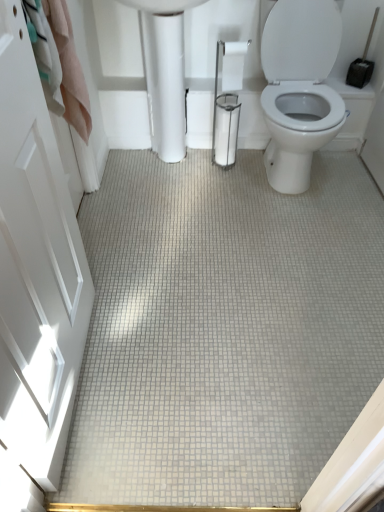
Question: Can you confirm if white glossy toilet paper at center is positioned to the left of white glossy porcelain at center?

Choices:
 (A) no
 (B) yes

Answer: (A)

Question: Can you see white glossy toilet paper at center touching white glossy porcelain at center?

Choices:
 (A) yes
 (B) no

Answer: (B)

Question: Is white glossy toilet paper at center far away from white glossy porcelain at center?

Choices:
 (A) no
 (B) yes

Answer: (A)

Question: From a real-world perspective, is white glossy toilet paper at center located higher than white glossy porcelain at center?

Choices:
 (A) yes
 (B) no

Answer: (A)

Question: Can you confirm if white glossy toilet paper at center is wider than white glossy porcelain at center?

Choices:
 (A) yes
 (B) no

Answer: (B)

Question: In the image, is white glossy porcelain at center on the left side or the right side of white glossy toilet paper at center?

Choices:
 (A) left
 (B) right

Answer: (A)

Question: From the image's perspective, is white glossy porcelain at center above or below white glossy toilet paper at center?

Choices:
 (A) below
 (B) above

Answer: (A)

Question: Choose the correct answer: Is white glossy porcelain at center inside white glossy toilet paper at center or outside it?

Choices:
 (A) inside
 (B) outside

Answer: (B)

Question: In terms of size, does white glossy porcelain at center appear bigger or smaller than white glossy toilet paper at center?

Choices:
 (A) small
 (B) big

Answer: (B)

Question: Is white glossy porcelain at center to the left or to the right of white glossy door at left in the image?

Choices:
 (A) right
 (B) left

Answer: (A)

Question: Would you say white glossy porcelain at center is inside or outside white glossy door at left?

Choices:
 (A) outside
 (B) inside

Answer: (A)

Question: Does point (173, 145) appear closer or farther from the camera than point (3, 259)?

Choices:
 (A) closer
 (B) farther

Answer: (B)

Question: From a real-world perspective, is white glossy porcelain at center physically located above or below white glossy door at left?

Choices:
 (A) above
 (B) below

Answer: (B)

Question: Is point (238, 61) positioned closer to the camera than point (162, 16)?

Choices:
 (A) farther
 (B) closer

Answer: (A)

Question: In terms of height, does white glossy toilet paper at center look taller or shorter compared to white glossy porcelain at center?

Choices:
 (A) tall
 (B) short

Answer: (B)